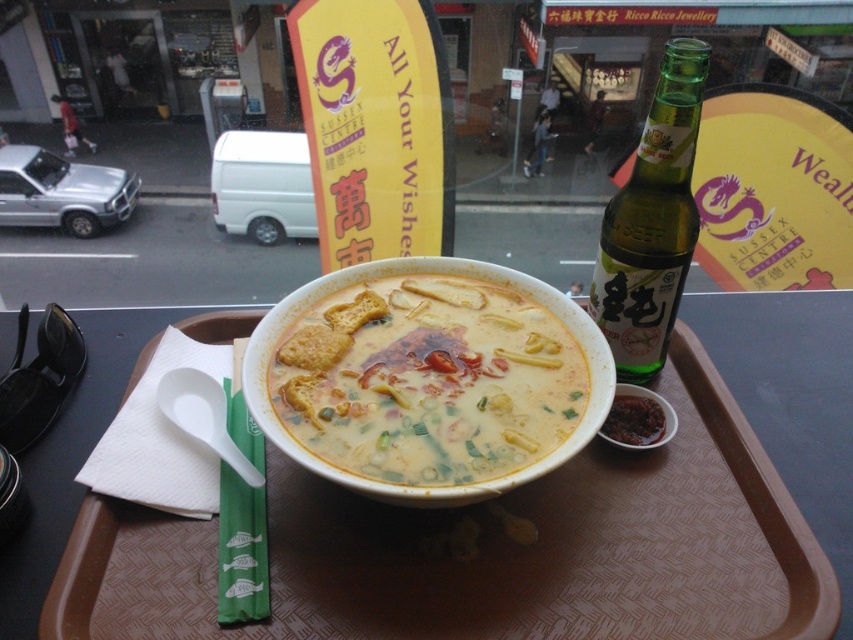
You are a waiter carrying a brown plastic tray at center and a green glass bottle at upper right. Which item is shorter in height?

The brown plastic tray at center has a lesser height compared to the green glass bottle at upper right, so the brown plastic tray at center is shorter.

You are a waiter in a restaurant. You need to place a new dish on the table where the brown plastic tray at center and the yellow creamy soup at center are located. Where should you place the new dish so it doesn not block the soup?

You should place the new dish to the right of the yellow creamy soup at center since the brown plastic tray at center is already to its left.

You are a waiter in a restaurant and need to place both the green glass bottle at upper right and the dark red paste at bowl right on a shelf that can only hold items up to 10 cm in width. Which item should you place first to ensure both fit?

The dark red paste at bowl right should be placed first because it is smaller in width than the green glass bottle at upper right, allowing both to fit within the 10 cm limit if the bottle is under 10 cm and the paste is smaller.